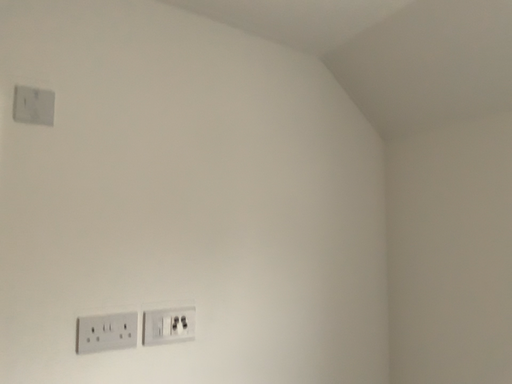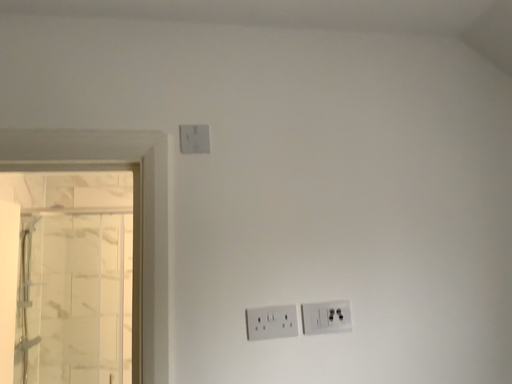
Question: How did the camera likely rotate when shooting the video?

Choices:
 (A) rotated right
 (B) rotated left

Answer: (B)